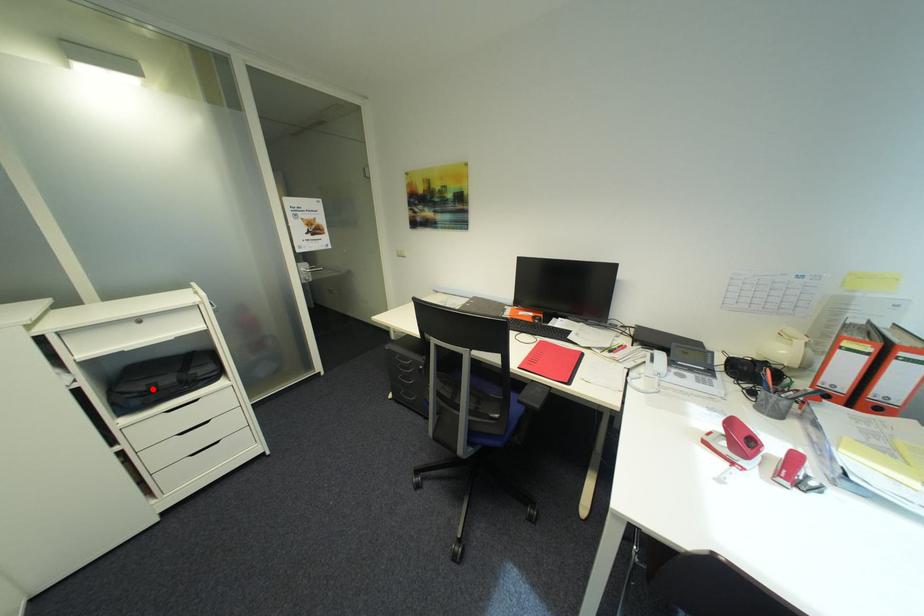
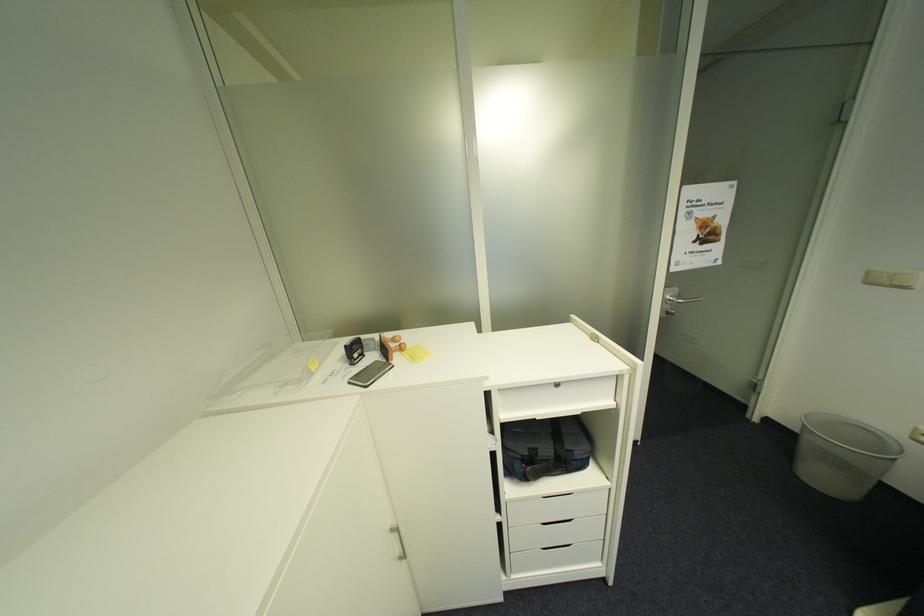
Question: I am providing you with two images of the same scene from different viewpoints. Given a red point in image1, look at the same physical point in image2. Is it:

Choices:
 (A) Closer to the viewpoint
 (B) Farther from the viewpoint

Answer: (B)